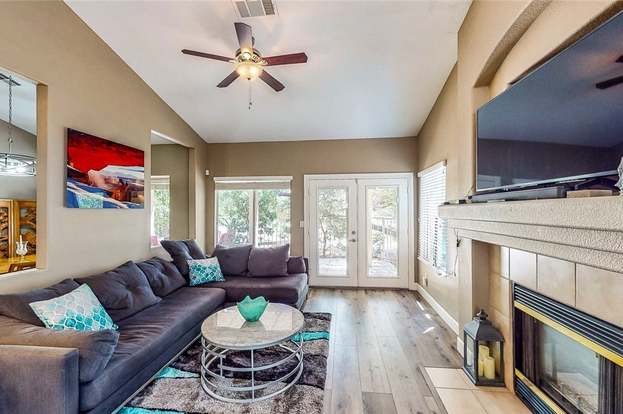
Image resolution: width=623 pixels, height=414 pixels. I want to click on wooden floor, so click(382, 356).